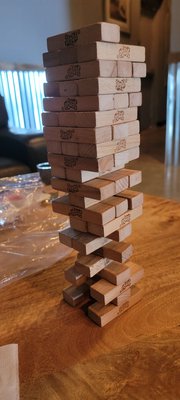
This screenshot has width=180, height=400. I want to click on framed picture of wall, so click(x=121, y=12).